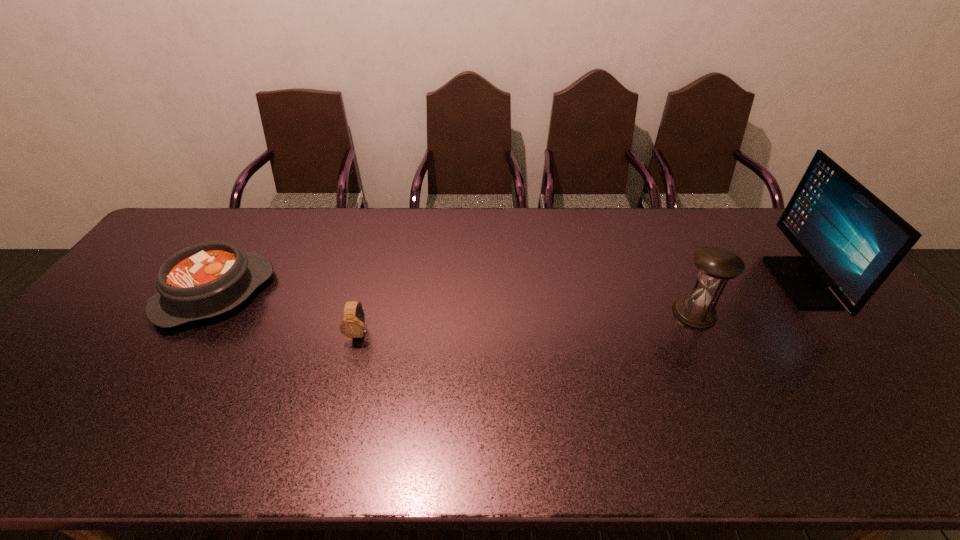
The width and height of the screenshot is (960, 540). In order to click on free space between the third shortest object and the tallest object in this screenshot , I will do `click(748, 298)`.

Identify the location of unoccupied position between the leftmost object and the watch. (287, 313).

Locate an element on the screen. empty space that is in between the second tallest object and the watch is located at coordinates (527, 322).

Locate an element on the screen. Image resolution: width=960 pixels, height=540 pixels. free point between the third shortest object and the monitor is located at coordinates (748, 298).

You are a GUI agent. You are given a task and a screenshot of the screen. Output one action in this format:
    pyautogui.click(x=<x>, y=<y>)
    Task: Click on the vacant area between the hourglass and the leftmost object
    This screenshot has width=960, height=540.
    Given the screenshot: What is the action you would take?
    pyautogui.click(x=455, y=303)

You are a GUI agent. You are given a task and a screenshot of the screen. Output one action in this format:
    pyautogui.click(x=<x>, y=<y>)
    Task: Click on the free space between the monitor and the casserole
    The height and width of the screenshot is (540, 960).
    Given the screenshot: What is the action you would take?
    pyautogui.click(x=509, y=288)

Identify the location of vacant space in between the rightmost object and the watch. The image size is (960, 540). (581, 307).

This screenshot has width=960, height=540. I want to click on vacant area that lies between the third object from left to right and the leftmost object, so click(455, 303).

You are a GUI agent. You are given a task and a screenshot of the screen. Output one action in this format:
    pyautogui.click(x=<x>, y=<y>)
    Task: Click on the vacant area that lies between the tallest object and the third object from left to right
    The image size is (960, 540).
    Given the screenshot: What is the action you would take?
    pyautogui.click(x=748, y=298)

Where is `free space between the second object from right to left and the casserole`? This screenshot has width=960, height=540. free space between the second object from right to left and the casserole is located at coordinates (455, 303).